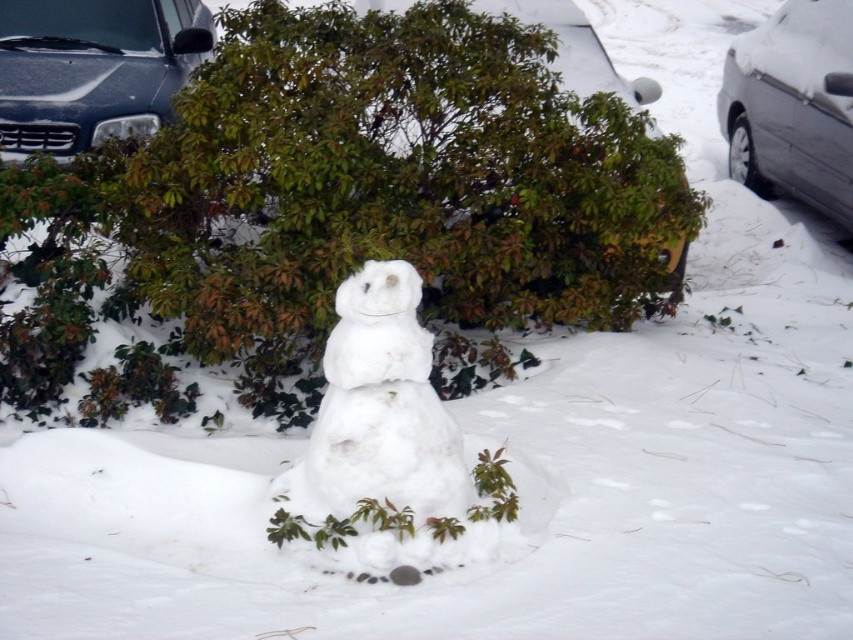
Does point (469, 540) lie in front of point (848, 205)?

Yes, it is in front of point (848, 205).

Image resolution: width=853 pixels, height=640 pixels. What do you see at coordinates (386, 445) in the screenshot?
I see `white fluffy snowman at center` at bounding box center [386, 445].

This screenshot has width=853, height=640. Find the location of `white fluffy snowman at center`. white fluffy snowman at center is located at coordinates (386, 445).

The height and width of the screenshot is (640, 853). Find the location of `white fluffy snowman at center`. white fluffy snowman at center is located at coordinates (386, 445).

Is point (341, 356) behind point (3, 20)?

That is False.

Can you confirm if white fluffy snowman at center is thinner than shiny black car at upper left?

Yes.

Is point (408, 262) farther from viewer compared to point (51, 125)?

No.

You are a GUI agent. You are given a task and a screenshot of the screen. Output one action in this format:
    pyautogui.click(x=<x>, y=<y>)
    Task: Click on the white fluffy snowman at center
    This screenshot has width=853, height=640.
    Given the screenshot: What is the action you would take?
    386,445

Is shiny black car at upper left below sleek silver sedan at right?

Yes, shiny black car at upper left is below sleek silver sedan at right.

Who is positioned more to the left, shiny black car at upper left or sleek silver sedan at right?

Positioned to the left is shiny black car at upper left.

What do you see at coordinates (93, 68) in the screenshot?
I see `shiny black car at upper left` at bounding box center [93, 68].

The image size is (853, 640). What are the coordinates of `shiny black car at upper left` in the screenshot? It's located at (93, 68).